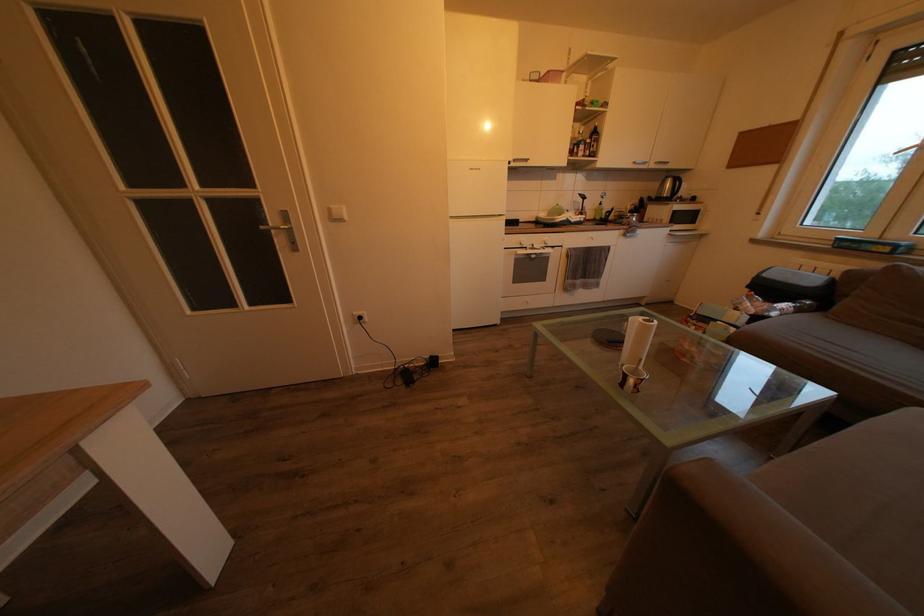
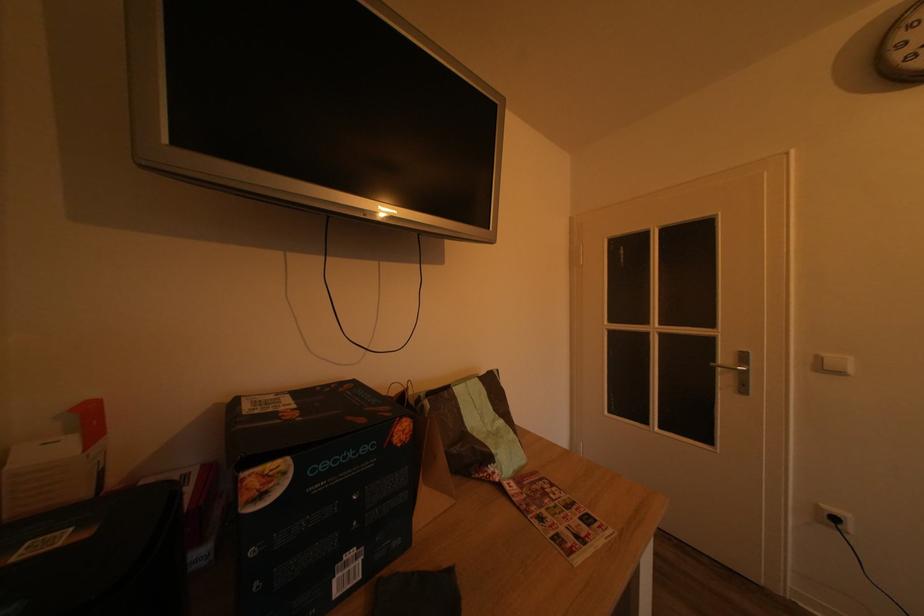
In the second image, find the point that corresponds to pixel 368 323 in the first image.

(843, 525)